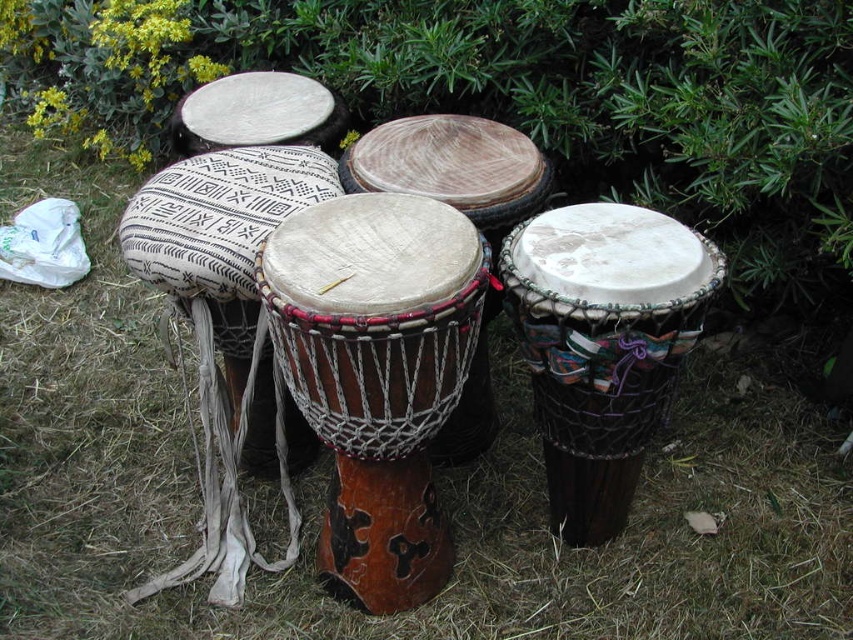
You are a drummer who wants to play the natural wood drum at center and the white fabric drum at upper center. Since you are standing in front of them, which drum will you need to reach for first?

The natural wood drum at center is closer to the viewer than the white fabric drum at upper center, so you will need to reach for the natural wood drum at center first.